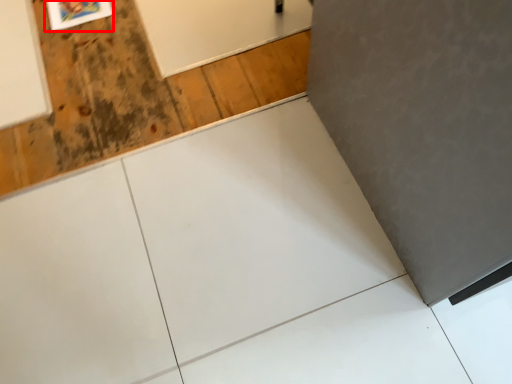
Question: From the image, what is the correct spatial relationship of picture frame (annotated by the red box) in relation to plywood?

Choices:
 (A) right
 (B) left

Answer: (B)